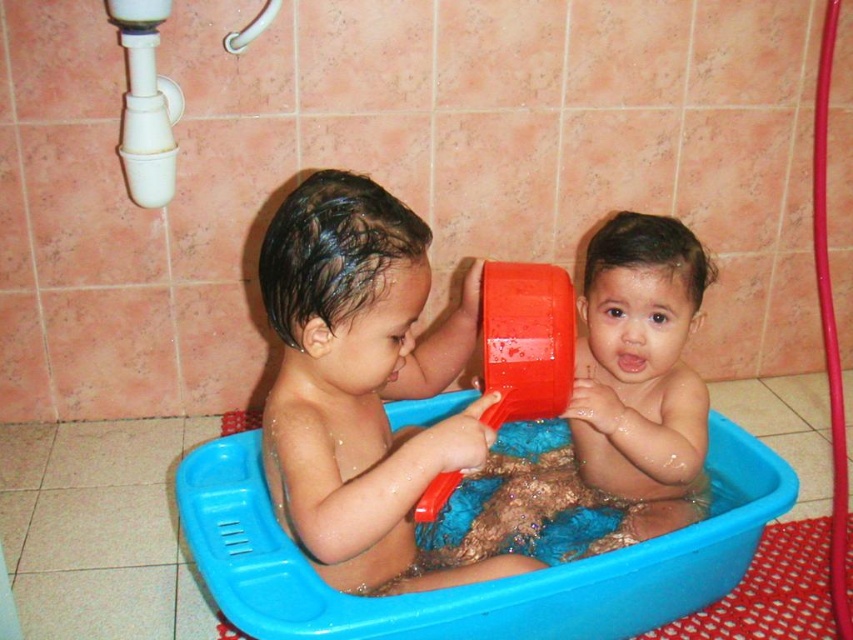
You are a parent trying to ensure the safety of your children in the bathroom. The matte plastic boy at center is playing near the white plastic shower at upper left. Considering their sizes, which object is more likely to be a safety hazard if the child reaches it?

The white plastic shower at upper left is smaller than the matte plastic boy at center, so the shower might be a safety hazard if the child can reach it, as it could be hot or slippery.

You are a parent trying to ensure the safety of your children in the bathroom. The blue plastic tub at center is located at point (480, 582). If you want to place a non slip mat under the tub, where should you place it relative to the children?

The blue plastic tub at center is located at point (480, 582). To place a non slip mat under it, position the mat directly beneath the tub at the same coordinates to ensure stability and prevent slipping.

You are a parent observing the bath scene. You notice the two children in the tub. Which child is positioned higher in the water, the matte plastic boy at center or the matte plastic baby at center?

The matte plastic boy at center is positioned higher than the matte plastic baby at center in the water.